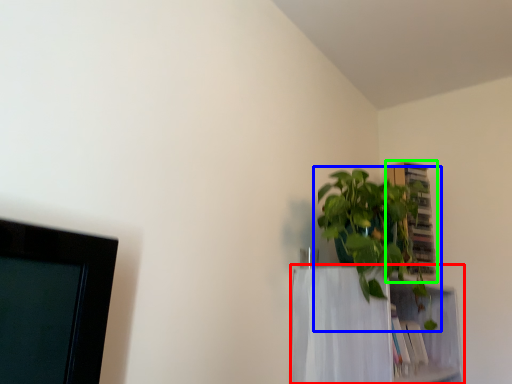
Question: Based on their relative distances, which object is nearer to shelf (highlighted by a red box)? Choose from houseplant (highlighted by a blue box) and cabinet (highlighted by a green box).

Choices:
 (A) houseplant
 (B) cabinet

Answer: (A)